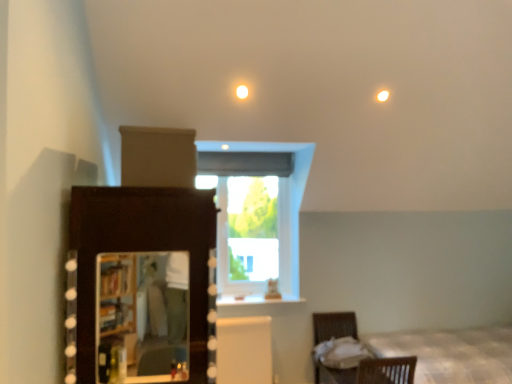
In order to click on white fabric at lower right in this screenshot , I will do `click(341, 353)`.

You are a GUI agent. You are given a task and a screenshot of the screen. Output one action in this format:
    pyautogui.click(x=<x>, y=<y>)
    Task: Click on the white fabric bed at lower right
    Image resolution: width=512 pixels, height=384 pixels.
    Given the screenshot: What is the action you would take?
    pyautogui.click(x=451, y=353)

The width and height of the screenshot is (512, 384). What do you see at coordinates (451, 353) in the screenshot?
I see `white fabric bed at lower right` at bounding box center [451, 353].

What do you see at coordinates (143, 317) in the screenshot?
I see `matte wooden mirror at lower left` at bounding box center [143, 317].

Where is `matte wooden mirror at lower left`? This screenshot has width=512, height=384. matte wooden mirror at lower left is located at coordinates (143, 317).

The height and width of the screenshot is (384, 512). What do you see at coordinates (141, 251) in the screenshot? I see `dark wood dresser at left` at bounding box center [141, 251].

I want to click on white fabric at lower right, so click(x=341, y=353).

From the image's perspective, is brown wicker basket at lower right positioned above or below dark wood dresser at left?

From the image's perspective, brown wicker basket at lower right appears below dark wood dresser at left.

Does point (395, 366) lie behind point (93, 327)?

Yes, it is behind point (93, 327).

Could you tell me if brown wicker basket at lower right is turned towards dark wood dresser at left?

Yes, brown wicker basket at lower right faces towards dark wood dresser at left.

Would you consider brown wicker basket at lower right to be distant from dark wood dresser at left?

brown wicker basket at lower right is far away from dark wood dresser at left.

Is brown wicker basket at lower right closer to camera compared to matte wooden mirror at lower left?

No, it is not.

From the image's perspective, which one is positioned lower, brown wicker basket at lower right or matte wooden mirror at lower left?

brown wicker basket at lower right.

Is point (405, 369) closer to camera compared to point (137, 275)?

Yes, point (405, 369) is in front of point (137, 275).

Between transparent glass window at center and white fabric at lower right, which one appears on the left side from the viewer's perspective?

transparent glass window at center is more to the left.

Is transparent glass window at center oriented towards white fabric at lower right?

No, transparent glass window at center is not aimed at white fabric at lower right.

Is transparent glass window at center not inside white fabric at lower right?

Yes, transparent glass window at center is located beyond the bounds of white fabric at lower right.

Considering the relative sizes of transparent glass window at center and white fabric at lower right in the image provided, is transparent glass window at center shorter than white fabric at lower right?

In fact, transparent glass window at center may be taller than white fabric at lower right.

Is transparent glass window at center inside or outside of brown wicker basket at lower right?

transparent glass window at center lies outside brown wicker basket at lower right.

Who is bigger, transparent glass window at center or brown wicker basket at lower right?

brown wicker basket at lower right is bigger.

Who is taller, transparent glass window at center or brown wicker basket at lower right?

transparent glass window at center is taller.

From the image's perspective, is transparent glass window at center located beneath brown wicker basket at lower right?

Incorrect, from the image's perspective, transparent glass window at center is higher than brown wicker basket at lower right.

Would you say brown wicker basket at lower right is outside white fabric bed at lower right?

Yes, brown wicker basket at lower right is located beyond the bounds of white fabric bed at lower right.

Considering the sizes of objects brown wicker basket at lower right and white fabric bed at lower right in the image provided, who is bigger, brown wicker basket at lower right or white fabric bed at lower right?

Bigger between the two is white fabric bed at lower right.

Looking at this image, from the image's perspective, is brown wicker basket at lower right above white fabric bed at lower right?

Actually, brown wicker basket at lower right appears below white fabric bed at lower right in the image.

Based on their positions, is brown wicker basket at lower right located to the left or right of white fabric bed at lower right?

brown wicker basket at lower right is positioned on white fabric bed at lower right's left side.

Is white fabric at lower right turned away from transparent glass window at center?

No, white fabric at lower right's orientation is not away from transparent glass window at center.

Looking at this image, in terms of width, does white fabric at lower right look wider or thinner when compared to transparent glass window at center?

white fabric at lower right is wider than transparent glass window at center.

Identify the location of window on the left of the white fabric at lower right. (257, 217).

Is white fabric at lower right to the left or to the right of transparent glass window at center in the image?

white fabric at lower right is to the right of transparent glass window at center.

How many degrees apart are the facing directions of white fabric bed at lower right and dark wood dresser at left?

They differ by 179 degrees in their facing directions.

Is white fabric bed at lower right beside dark wood dresser at left?

There is a gap between white fabric bed at lower right and dark wood dresser at left.

Consider the image. Is dark wood dresser at left surrounded by white fabric bed at lower right?

No, dark wood dresser at left is not surrounded by white fabric bed at lower right.

Is white fabric bed at lower right further to the viewer compared to dark wood dresser at left?

Yes, it is.

The height and width of the screenshot is (384, 512). Find the location of `furniture behind the dark wood dresser at left`. furniture behind the dark wood dresser at left is located at coordinates (376, 372).

This screenshot has width=512, height=384. In order to click on furniture on the right of matte wooden mirror at lower left in this screenshot , I will do 376,372.

Based on the photo, from the image, which object appears to be nearer to dark wood dresser at left, transparent glass window at center or brown wicker basket at lower right?

brown wicker basket at lower right.

Which object lies nearer to the anchor point transparent glass window at center, white fabric at lower right or matte wooden mirror at lower left?

The object closer to transparent glass window at center is white fabric at lower right.

Based on their spatial positions, is brown wicker basket at lower right or white fabric at lower right further from matte wooden mirror at lower left?

Among the two, brown wicker basket at lower right is located further to matte wooden mirror at lower left.

Estimate the real-world distances between objects in this image. Which object is further from brown wicker basket at lower right, dark wood dresser at left or white fabric at lower right?

dark wood dresser at left is positioned further to the anchor brown wicker basket at lower right.

Looking at the image, which one is located closer to white fabric at lower right, transparent glass window at center or dark wood dresser at left?

Based on the image, transparent glass window at center appears to be nearer to white fabric at lower right.

From the image, which object appears to be farther from transparent glass window at center, white fabric bed at lower right or dark wood dresser at left?

Among the two, dark wood dresser at left is located further to transparent glass window at center.

Which object lies nearer to the anchor point brown wicker basket at lower right, white fabric at lower right or transparent glass window at center?

white fabric at lower right is positioned closer to the anchor brown wicker basket at lower right.

Based on their spatial positions, is white fabric at lower right or dark wood dresser at left further from matte wooden mirror at lower left?

Based on the image, white fabric at lower right appears to be further to matte wooden mirror at lower left.

This screenshot has width=512, height=384. Find the location of `sheet located between transparent glass window at center and white fabric bed at lower right in the left-right direction`. sheet located between transparent glass window at center and white fabric bed at lower right in the left-right direction is located at coordinates (341, 353).

Locate an element on the screen. Image resolution: width=512 pixels, height=384 pixels. sheet positioned between dark wood dresser at left and transparent glass window at center from near to far is located at coordinates (341, 353).

Image resolution: width=512 pixels, height=384 pixels. Identify the location of window located between matte wooden mirror at lower left and white fabric bed at lower right in the left-right direction. (257, 217).

Identify the location of furniture between dark wood dresser at left and transparent glass window at center from front to back. This screenshot has height=384, width=512. [x=376, y=372].